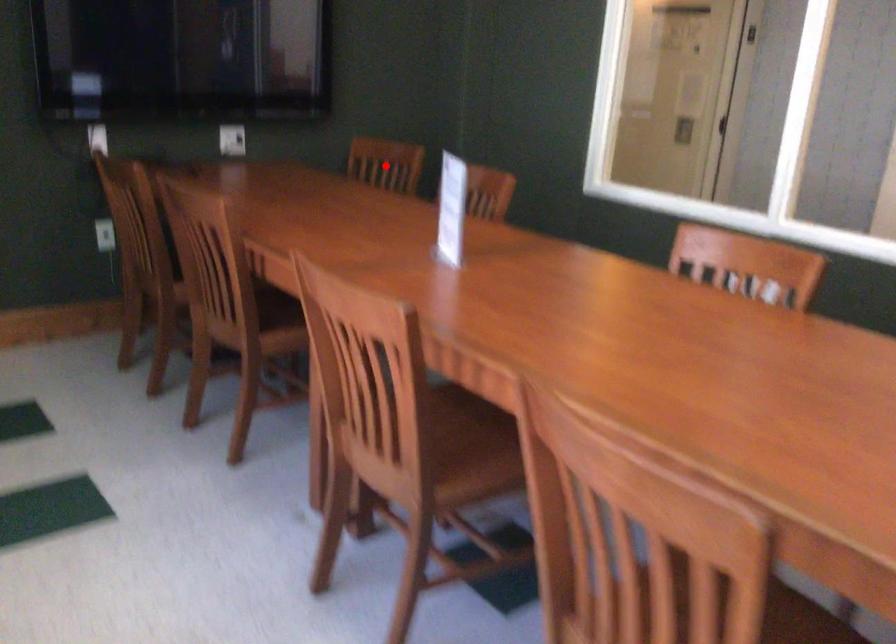
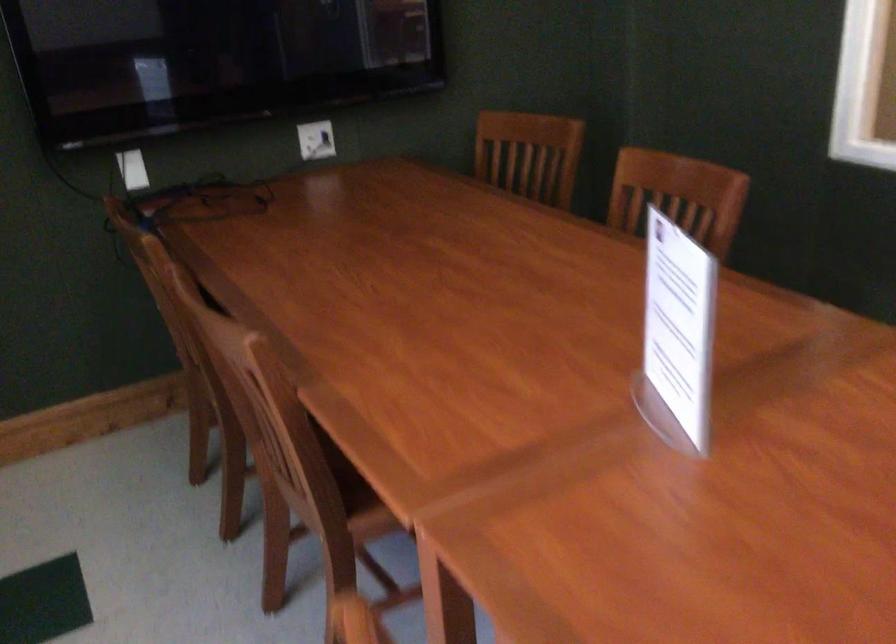
Locate, in the second image, the point that corresponds to the highlighted location in the first image.

(529, 154)